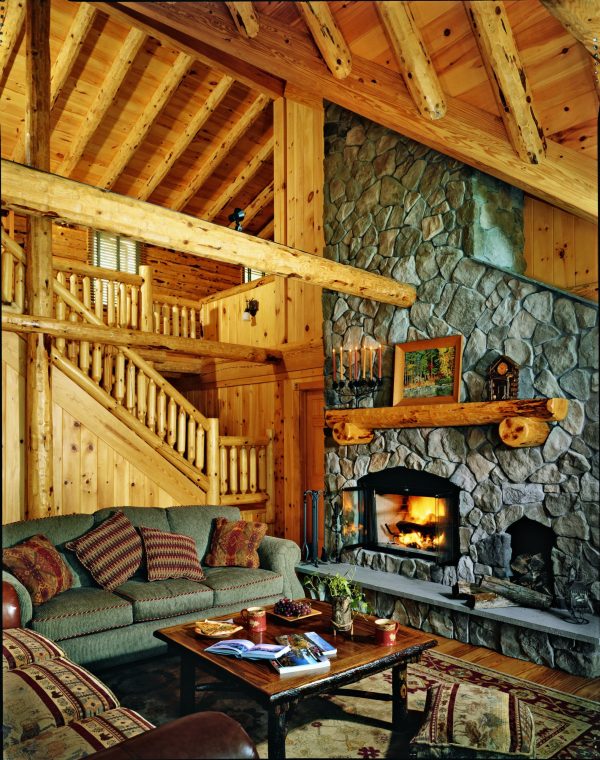
Locate an element on the screen. tip of brown sofa arm on left is located at coordinates (9, 602).